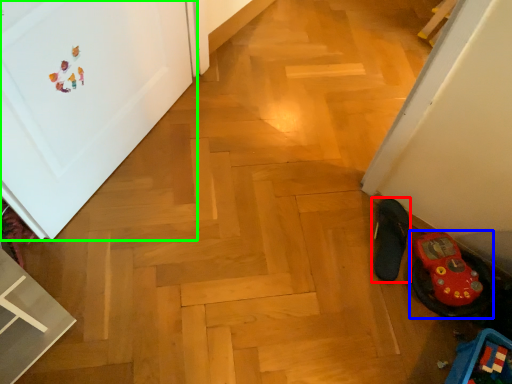
Question: Considering the real-world distances, which object is closest to footwear (highlighted by a red box)? footwear (highlighted by a blue box) or door (highlighted by a green box).

Choices:
 (A) footwear
 (B) door

Answer: (A)